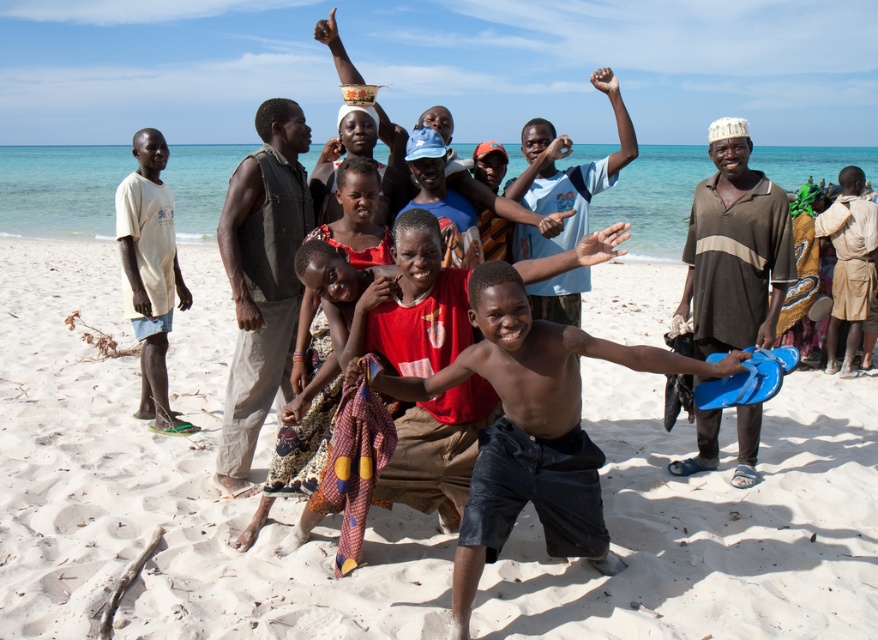
Question: Can you confirm if brown striped shirt at right is positioned above brown fabric at right?

Choices:
 (A) no
 (B) yes

Answer: (A)

Question: Which of the following is the farthest from the observer?

Choices:
 (A) shiny blue shorts at center
 (B) white sand at center
 (C) brown striped shirt at right

Answer: (C)

Question: Which point is closer to the camera?

Choices:
 (A) brown striped shirt at right
 (B) shiny blue shorts at center
 (C) brown fabric at right
 (D) dark brown cotton vest at center

Answer: (B)

Question: Which object is positioned farthest from the white sand at center?

Choices:
 (A) light yellow t-shirt at left
 (B) dark brown cotton vest at center
 (C) brown striped shirt at right
 (D) shiny blue shorts at center

Answer: (C)

Question: Can you confirm if shiny blue shorts at center is bigger than dark brown cotton vest at center?

Choices:
 (A) no
 (B) yes

Answer: (B)

Question: Observing the image, what is the correct spatial positioning of dark brown cotton vest at center in reference to light yellow t-shirt at left?

Choices:
 (A) right
 (B) left

Answer: (A)